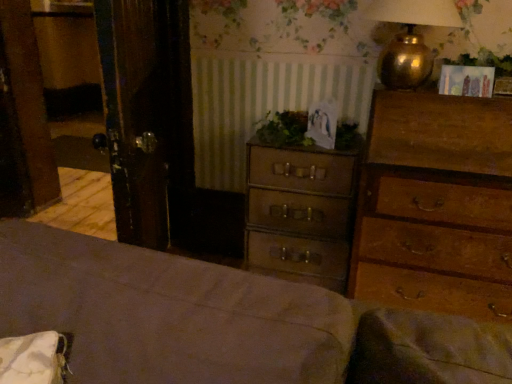
Question: Can you confirm if gold metallic lamp at upper right is smaller than green leafy plant at center, positioned as the 1th plant in bottom-to-top order?

Choices:
 (A) no
 (B) yes

Answer: (A)

Question: Is gold metallic lamp at upper right to the left of green leafy plant at center, arranged as the 2th plant when viewed from the right, from the viewer's perspective?

Choices:
 (A) yes
 (B) no

Answer: (B)

Question: Is gold metallic lamp at upper right facing away from green leafy plant at center, positioned as the 1th plant in bottom-to-top order?

Choices:
 (A) yes
 (B) no

Answer: (B)

Question: Considering the relative sizes of gold metallic lamp at upper right and green leafy plant at center, which is the 1th plant from left to right, in the image provided, is gold metallic lamp at upper right thinner than green leafy plant at center, which is the 1th plant from left to right,?

Choices:
 (A) yes
 (B) no

Answer: (B)

Question: Is gold metallic lamp at upper right touching green leafy plant at center, positioned as the second plant in top-to-bottom order?

Choices:
 (A) no
 (B) yes

Answer: (A)

Question: From a real-world perspective, is gold metallic lamp at upper right positioned above or below green leafy plant at center, positioned as the second plant in top-to-bottom order?

Choices:
 (A) above
 (B) below

Answer: (A)

Question: In terms of height, does gold metallic lamp at upper right look taller or shorter compared to green leafy plant at center, positioned as the second plant in top-to-bottom order?

Choices:
 (A) short
 (B) tall

Answer: (B)

Question: Is point (391, 67) closer or farther from the camera than point (298, 140)?

Choices:
 (A) farther
 (B) closer

Answer: (B)

Question: Is gold metallic lamp at upper right in front of or behind green leafy plant at center, arranged as the 2th plant when viewed from the right, in the image?

Choices:
 (A) front
 (B) behind

Answer: (A)

Question: In terms of width, does green leafy plant at center, arranged as the 2th plant when viewed from the right, look wider or thinner when compared to gold metallic lamp at upper right?

Choices:
 (A) wide
 (B) thin

Answer: (B)

Question: In the image, is green leafy plant at center, arranged as the 2th plant when viewed from the right, on the left side or the right side of gold metallic lamp at upper right?

Choices:
 (A) right
 (B) left

Answer: (B)

Question: Relative to gold metallic lamp at upper right, is green leafy plant at center, arranged as the 2th plant when viewed from the right, in front or behind?

Choices:
 (A) behind
 (B) front

Answer: (A)

Question: From a real-world perspective, is green leafy plant at center, positioned as the 1th plant in bottom-to-top order, above or below gold metallic lamp at upper right?

Choices:
 (A) above
 (B) below

Answer: (B)

Question: Is wooden chest of drawers at right, which is counted as the 1th chest of drawers, starting from the right, taller or shorter than brown leather suitcase at center, which ranks as the first chest of drawers in left-to-right order?

Choices:
 (A) short
 (B) tall

Answer: (B)

Question: Does point (510, 125) appear closer or farther from the camera than point (303, 205)?

Choices:
 (A) farther
 (B) closer

Answer: (B)